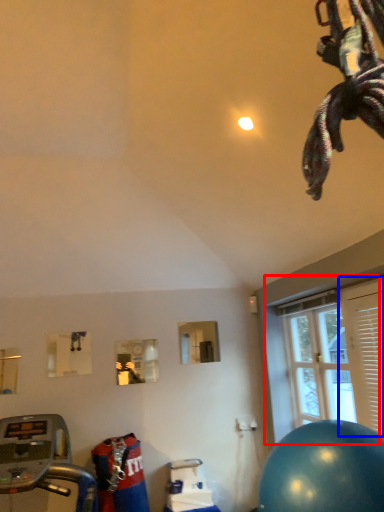
Question: Which object appears farthest to the camera in this image, window (highlighted by a red box) or shutter (highlighted by a blue box)?

Choices:
 (A) window
 (B) shutter

Answer: (A)